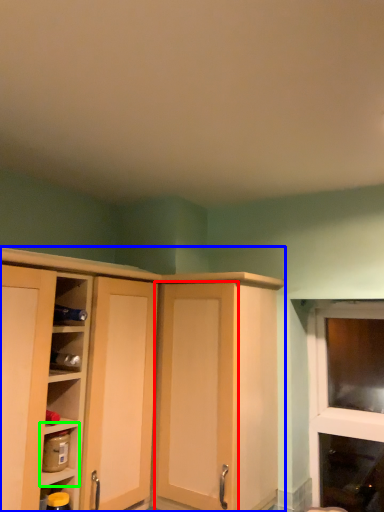
Question: Which object is the closest to the screen door (highlighted by a red box)? Choose among these: cupboard (highlighted by a blue box) or shelf (highlighted by a green box).

Choices:
 (A) cupboard
 (B) shelf

Answer: (A)